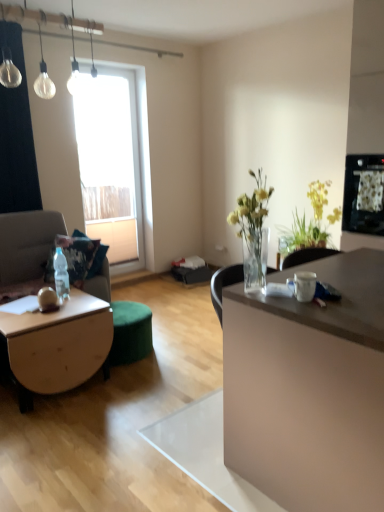
Question: Is white glossy mug at center oriented away from wooden coffee table at lower left?

Choices:
 (A) no
 (B) yes

Answer: (A)

Question: Is white glossy mug at center positioned in front of wooden coffee table at lower left?

Choices:
 (A) yes
 (B) no

Answer: (A)

Question: From a real-world perspective, does white glossy mug at center sit lower than wooden coffee table at lower left?

Choices:
 (A) yes
 (B) no

Answer: (B)

Question: Is wooden coffee table at lower left a part of white glossy mug at center?

Choices:
 (A) no
 (B) yes

Answer: (A)

Question: Does white glossy mug at center have a lesser width compared to wooden coffee table at lower left?

Choices:
 (A) yes
 (B) no

Answer: (A)

Question: Considering the relative sizes of white glossy mug at center and wooden coffee table at lower left in the image provided, is white glossy mug at center bigger than wooden coffee table at lower left?

Choices:
 (A) no
 (B) yes

Answer: (A)

Question: From a real-world perspective, is clear plastic bottle at lower left beneath transparent glass window at upper left?

Choices:
 (A) yes
 (B) no

Answer: (A)

Question: Is transparent glass window at upper left completely or partially inside clear plastic bottle at lower left?

Choices:
 (A) yes
 (B) no

Answer: (B)

Question: Considering the relative sizes of clear plastic bottle at lower left and transparent glass window at upper left in the image provided, is clear plastic bottle at lower left taller than transparent glass window at upper left?

Choices:
 (A) yes
 (B) no

Answer: (B)

Question: From a real-world perspective, is clear plastic bottle at lower left physically above transparent glass window at upper left?

Choices:
 (A) no
 (B) yes

Answer: (A)

Question: Is clear plastic bottle at lower left at the left side of transparent glass window at upper left?

Choices:
 (A) yes
 (B) no

Answer: (B)

Question: From the image's perspective, is clear plastic bottle at lower left located beneath transparent glass window at upper left?

Choices:
 (A) yes
 (B) no

Answer: (A)

Question: Can you confirm if yellow-green leafy plant at upper right is bigger than clear glass light bulb at upper left?

Choices:
 (A) yes
 (B) no

Answer: (B)